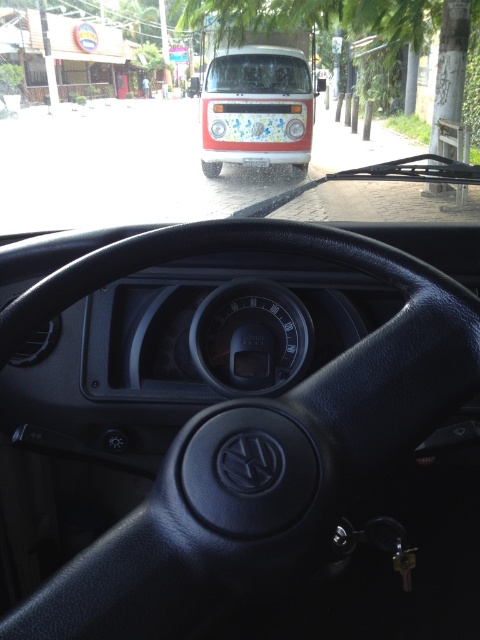
Question: Does white glossy bus at center appear on the left side of transparent glass windshield at center?

Choices:
 (A) yes
 (B) no

Answer: (B)

Question: Among these points, which one is farthest from the camera?

Choices:
 (A) (430, 378)
 (B) (279, 60)

Answer: (B)

Question: Which point is farther to the camera?

Choices:
 (A) (267, 81)
 (B) (327, 436)
 (C) (244, 104)

Answer: (A)

Question: Which object is positioned farthest from the black leather steering wheel at center?

Choices:
 (A) transparent glass windshield at center
 (B) white glossy bus at center

Answer: (A)

Question: Where is black leather steering wheel at center located in relation to white glossy bus at center in the image?

Choices:
 (A) above
 (B) below

Answer: (B)

Question: Does white glossy bus at center have a lesser width compared to transparent glass windshield at center?

Choices:
 (A) yes
 (B) no

Answer: (B)